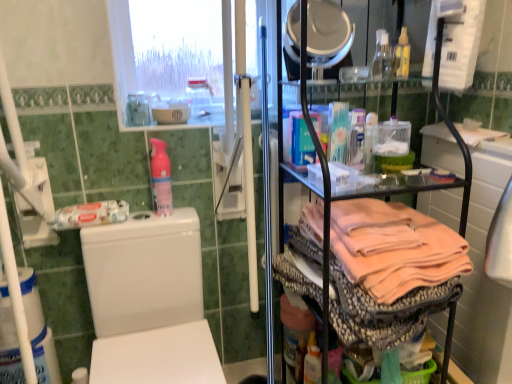
Locate an element on the screen. This screenshot has width=512, height=384. free space in front of pink plastic spray bottle at upper center, which is the second bottle from left to right is located at coordinates (151, 223).